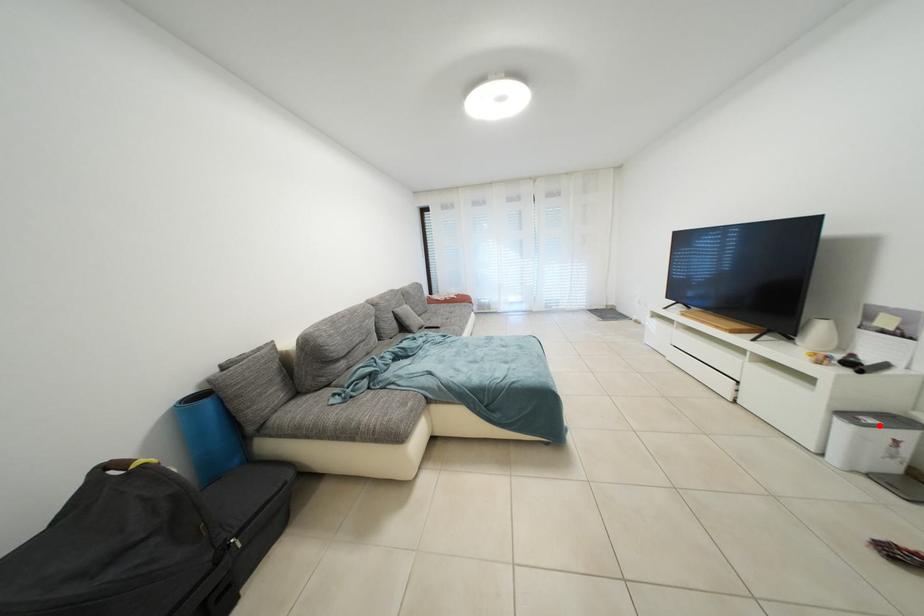
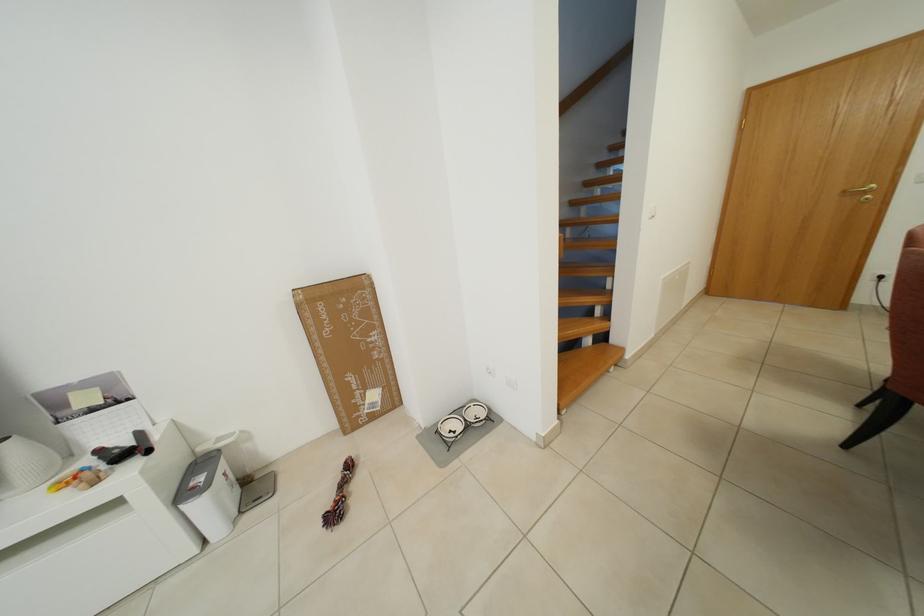
The point at the highlighted location is marked in the first image. Where is the corresponding point in the second image?

(208, 484)